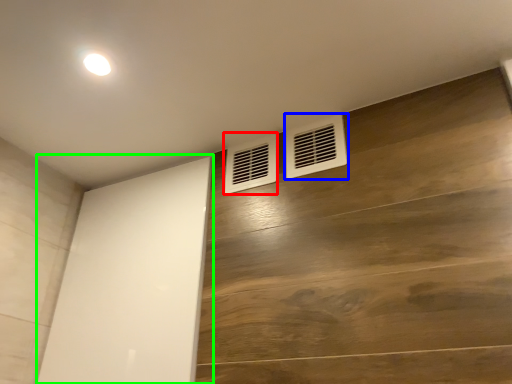
Question: Based on their relative distances, which object is nearer to air conditioning (highlighted by a red box)? Choose from air conditioning (highlighted by a blue box) and screen door (highlighted by a green box).

Choices:
 (A) air conditioning
 (B) screen door

Answer: (A)